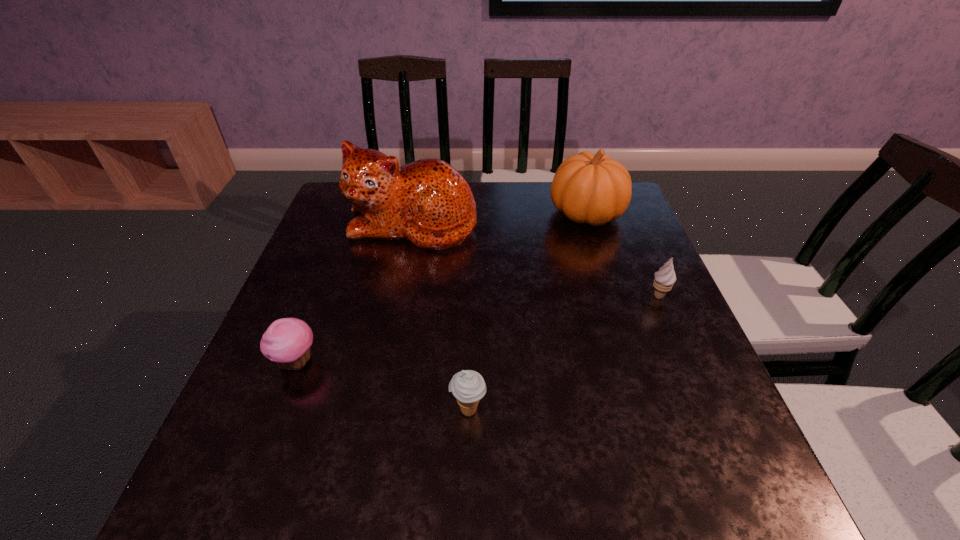
Find the location of a particular element. free region located on the left of the left icecream is located at coordinates (331, 410).

In order to click on free space located on the back of the second nearest object in this screenshot , I will do `click(341, 247)`.

At what (x,y) coordinates should I click in order to perform the action: click on cat positioned at the far edge. Please return your answer as a coordinate pair (x, y). This screenshot has width=960, height=540. Looking at the image, I should click on (428, 202).

In order to click on pumpkin present at the far edge in this screenshot , I will do `click(590, 188)`.

Where is `cat that is at the left edge`? Image resolution: width=960 pixels, height=540 pixels. cat that is at the left edge is located at coordinates (428, 202).

Image resolution: width=960 pixels, height=540 pixels. What are the coordinates of `cupcake that is at the left edge` in the screenshot? It's located at 287,341.

At what (x,y) coordinates should I click in order to perform the action: click on pumpkin present at the right edge. Please return your answer as a coordinate pair (x, y). This screenshot has width=960, height=540. Looking at the image, I should click on (590, 188).

Find the location of a particular element. The image size is (960, 540). icecream that is at the right edge is located at coordinates (664, 279).

I want to click on object located in the far left corner section of the desktop, so click(428, 202).

Find the location of a particular element. This screenshot has width=960, height=540. object that is at the far right corner is located at coordinates (590, 188).